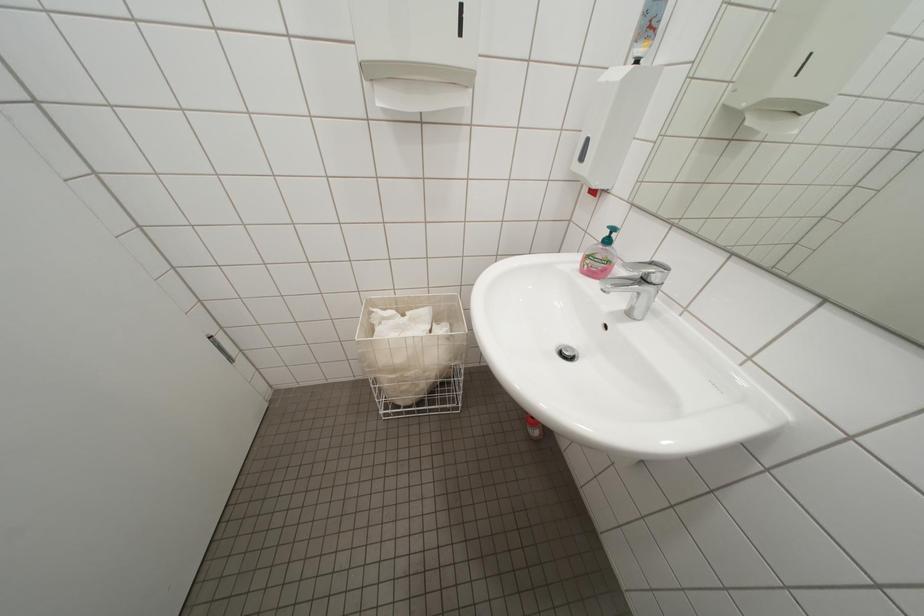
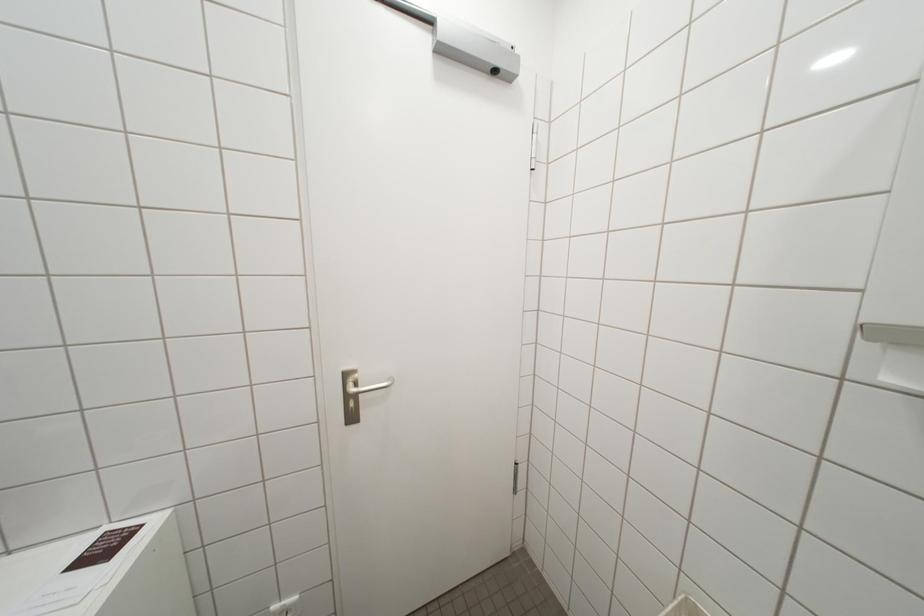
Question: The camera is either moving clockwise (left) or counter-clockwise (right) around the object. The first image is from the beginning of the video and the second image is from the end. Is the camera moving left or right when shooting the video?

Choices:
 (A) Left
 (B) Right

Answer: (B)